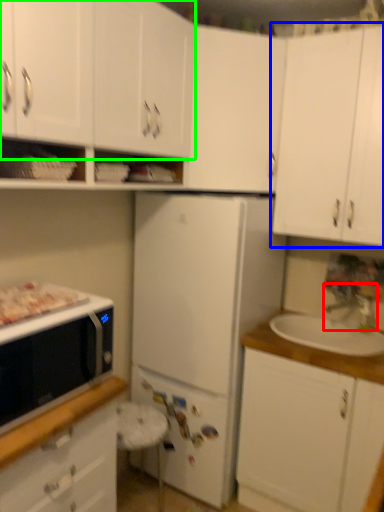
Question: Which object is the farthest from faucet (highlighted by a red box)? Choose among these: cabinetry (highlighted by a blue box) or cabinetry (highlighted by a green box).

Choices:
 (A) cabinetry
 (B) cabinetry

Answer: (B)